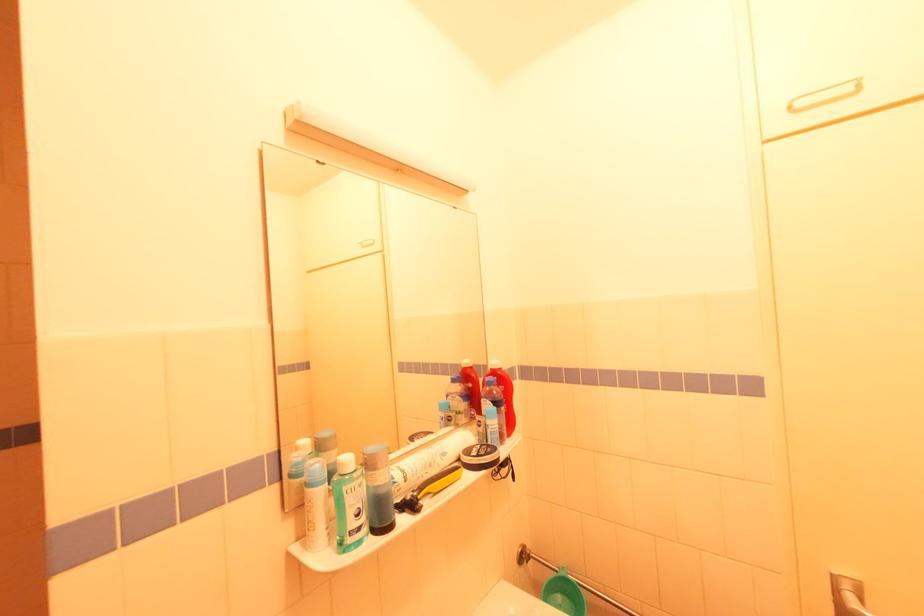
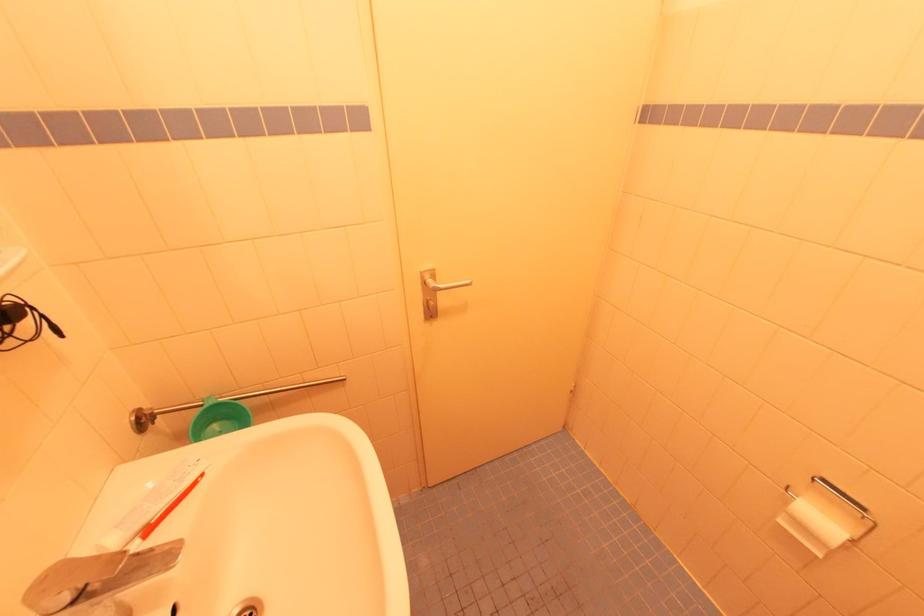
Locate, in the second image, the point that corresponds to point (835, 573) in the first image.

(423, 272)